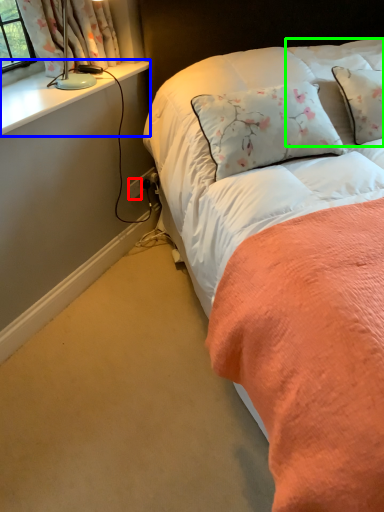
Question: Considering the real-world distances, which object is closest to power outlet (highlighted by a red box)? window sill (highlighted by a blue box) or pillow (highlighted by a green box).

Choices:
 (A) window sill
 (B) pillow

Answer: (A)